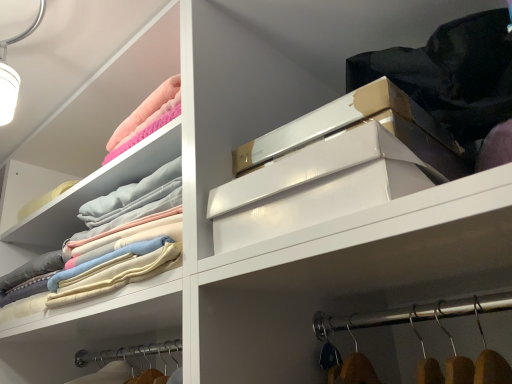
The image size is (512, 384). Describe the element at coordinates (125, 241) in the screenshot. I see `soft cotton sweaters at left` at that location.

This screenshot has width=512, height=384. Identify the location of soft cotton sweaters at left. (125, 241).

You are a GUI agent. You are given a task and a screenshot of the screen. Output one action in this format:
    pyautogui.click(x=<x>, y=<y>)
    Task: Click on the soft cotton sweaters at left
    The height and width of the screenshot is (384, 512).
    Given the screenshot: What is the action you would take?
    [x=125, y=241]